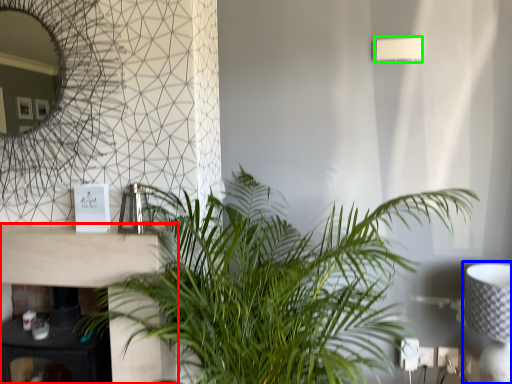
Question: Which object is the farthest from table (highlighted by a red box)? Choose among these: table lamp (highlighted by a blue box) or lamp (highlighted by a green box).

Choices:
 (A) table lamp
 (B) lamp

Answer: (B)